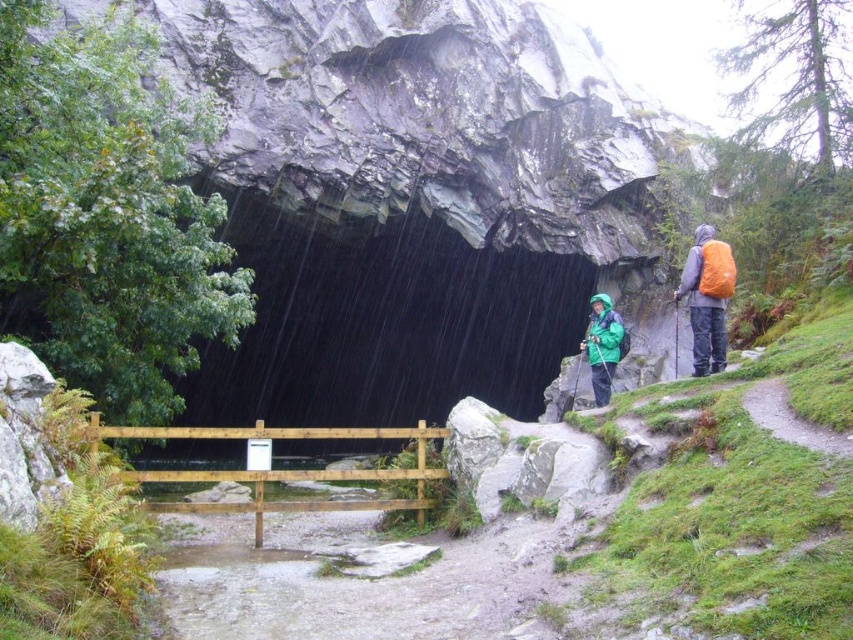
You are a hiker planning to cross the wooden bridge and head toward the dark gray stone cave at center. Your orange backpack at right is on your back. Can your backpack fit through the cave entrance without getting stuck?

The dark gray stone cave at center is wider than the orange backpack at right, so the backpack should fit through the cave entrance without getting stuck.

You are planning to take a shortcut to the cave entrance. You have an orange backpack at right and a dark gray stone cave at center. Which object is closer to you as you approach the cave?

The dark gray stone cave at center is closer to you than the orange backpack at right, so the cave entrance is nearer as you approach.

You are a hiker planning to cross the wooden bridge in the image. The bridge can only support a maximum of 1.5 meters between any two people. You see two hikers wearing the green waterproof jacket at center and the green matte jacket at center walking towards the cave. Are they positioned safely on the bridge according to the bridge safety rules?

The green waterproof jacket at center and green matte jacket at center are 1.40 meters apart from each other, which is within the bridge safety rule of 1.5 meters maximum distance between people. Therefore, they are positioned safely on the bridge.